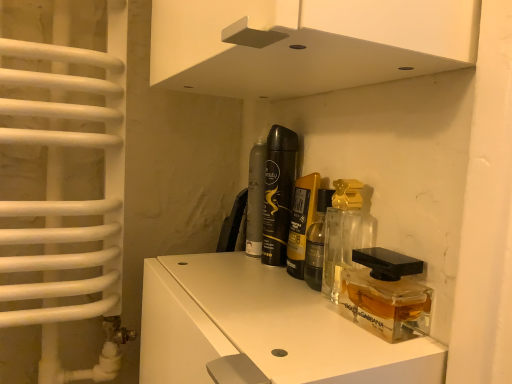
The image size is (512, 384). Identify the location of free space to the left of translucent glass perfume at center, placed as the third perfume when sorted from front to back. (206, 264).